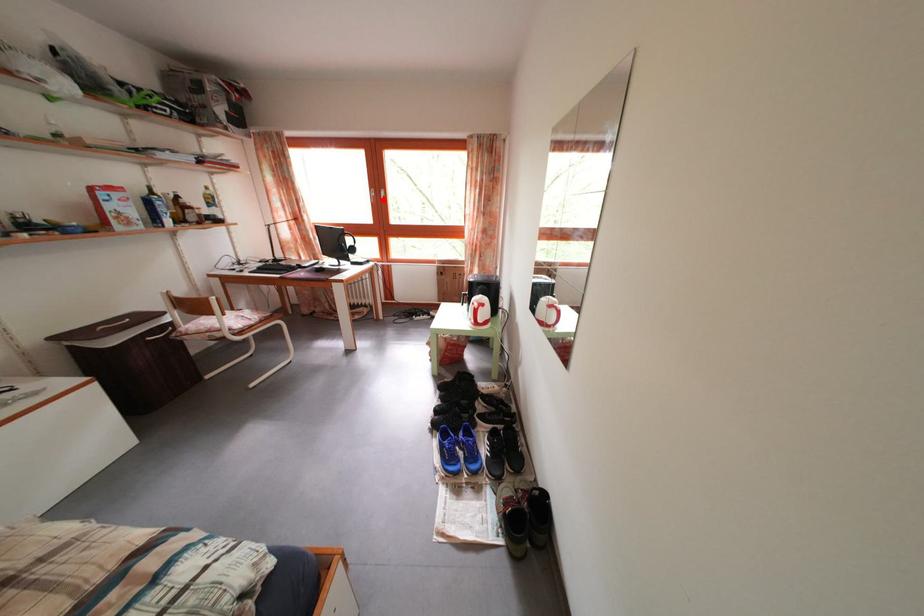
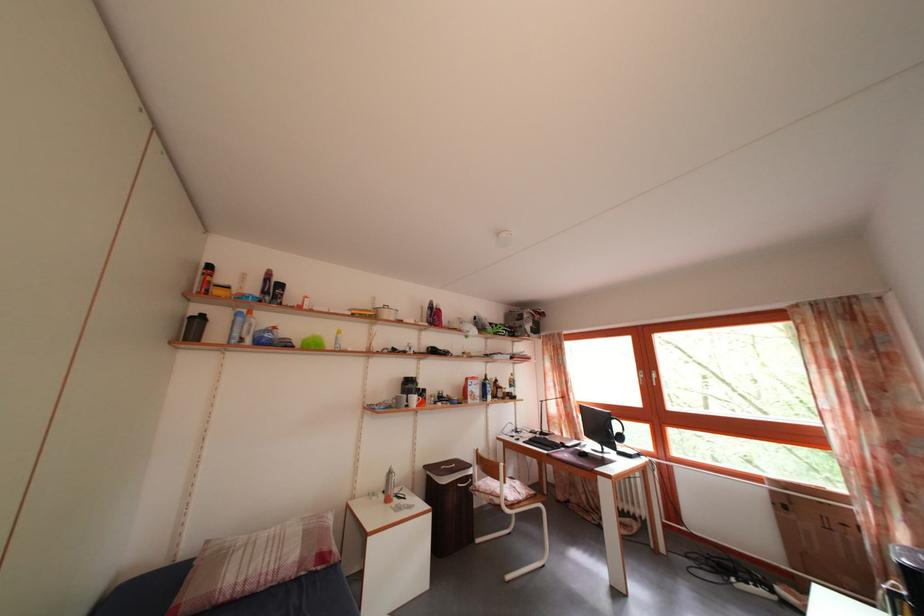
Question: I am providing you with two images of the same scene from different viewpoints. A red point is marked on the first image. Can you still see the location of the red point in image 2?

Choices:
 (A) Yes
 (B) No

Answer: (A)